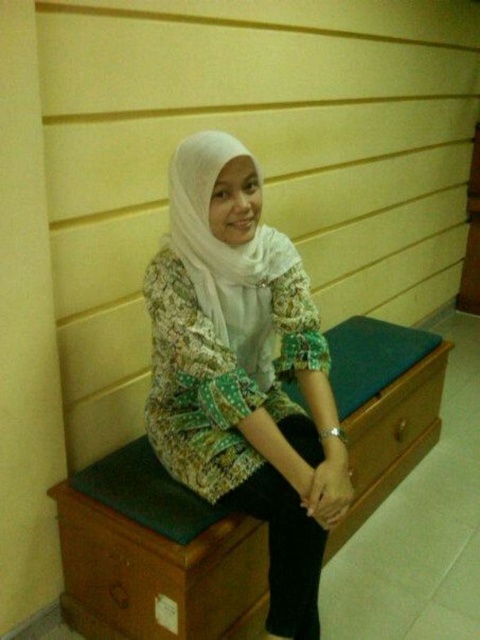
Question: Is white sheer headscarf at center bigger than green fabric drawer at center?

Choices:
 (A) no
 (B) yes

Answer: (A)

Question: Which object is the farthest from the white sheer headscarf at center?

Choices:
 (A) green fabric drawer at center
 (B) batik fabric hijab at center

Answer: (A)

Question: Is white sheer headscarf at center bigger than green fabric drawer at center?

Choices:
 (A) no
 (B) yes

Answer: (A)

Question: Which object appears closest to the camera in this image?

Choices:
 (A) green fabric drawer at center
 (B) white sheer headscarf at center
 (C) batik fabric hijab at center

Answer: (C)

Question: Which is farther from the green fabric drawer at center?

Choices:
 (A) batik fabric hijab at center
 (B) white sheer headscarf at center

Answer: (B)

Question: Can you confirm if batik fabric hijab at center is thinner than white sheer headscarf at center?

Choices:
 (A) yes
 (B) no

Answer: (B)